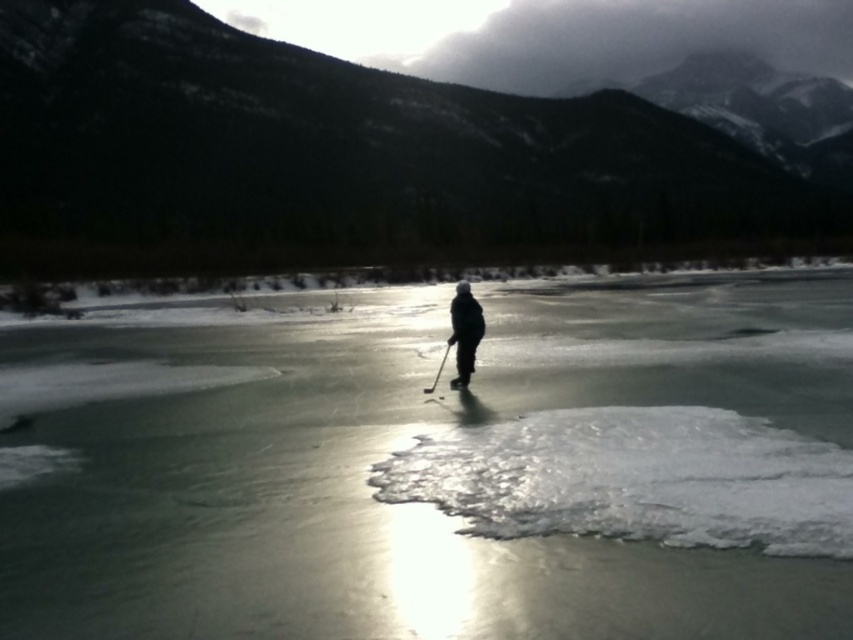
Question: Which object appears closest to the camera in this image?

Choices:
 (A) black matte jacket at center
 (B) transparent ice at center
 (C) black plastic ski pole at center

Answer: (B)

Question: Can you confirm if transparent ice at center is thinner than black plastic ski pole at center?

Choices:
 (A) no
 (B) yes

Answer: (A)

Question: Can you confirm if transparent ice at center is thinner than black plastic ski pole at center?

Choices:
 (A) yes
 (B) no

Answer: (B)

Question: Where is transparent ice at center located in relation to black matte jacket at center in the image?

Choices:
 (A) below
 (B) above

Answer: (B)

Question: Which point is closer to the camera?

Choices:
 (A) black plastic ski pole at center
 (B) transparent ice at center

Answer: (B)

Question: Which object is closer to the camera taking this photo?

Choices:
 (A) black plastic ski pole at center
 (B) transparent ice at center
 (C) black matte jacket at center

Answer: (B)